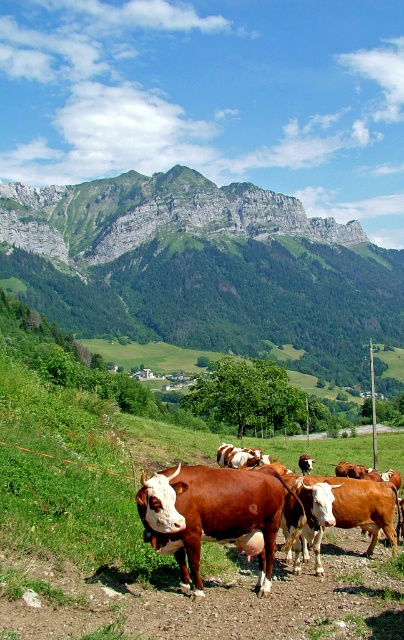
Question: Does rugged stone mountain at upper center have a lesser width compared to brown glossy cow at center?

Choices:
 (A) no
 (B) yes

Answer: (A)

Question: Does green rocky mountain at upper center lie behind brown glossy cow at center?

Choices:
 (A) no
 (B) yes

Answer: (B)

Question: Based on their relative distances, which object is farther from the brown glossy cow at center?

Choices:
 (A) green rocky mountain at upper center
 (B) rugged stone mountain at upper center

Answer: (B)

Question: Which of the following is the closest to the observer?

Choices:
 (A) (65, 237)
 (B) (282, 308)

Answer: (B)

Question: Is green rocky mountain at upper center below rugged stone mountain at upper center?

Choices:
 (A) no
 (B) yes

Answer: (B)

Question: Considering the real-world distances, which object is closest to the rugged stone mountain at upper center?

Choices:
 (A) green rocky mountain at upper center
 (B) brown glossy cow at center

Answer: (A)